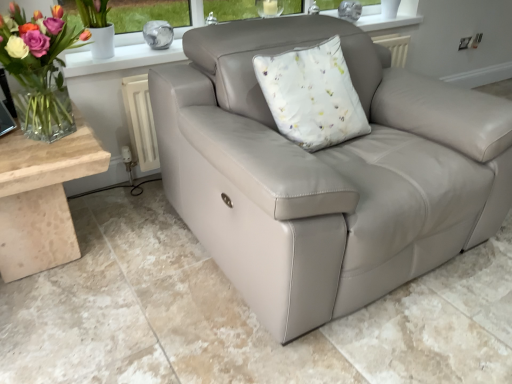
The image size is (512, 384). Find the location of `blank area beneath beige marble table at lower left (from a real-world perspective)`. blank area beneath beige marble table at lower left (from a real-world perspective) is located at coordinates (78, 252).